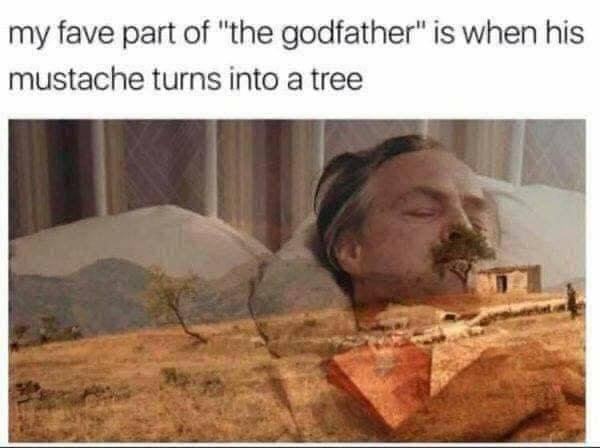
You are a GUI agent. You are given a task and a screenshot of the screen. Output one action in this format:
    pyautogui.click(x=<x>, y=<y>)
    Task: Click on the pillows
    This screenshot has width=600, height=448.
    Given the screenshot: What is the action you would take?
    pyautogui.click(x=194, y=252), pyautogui.click(x=567, y=226)